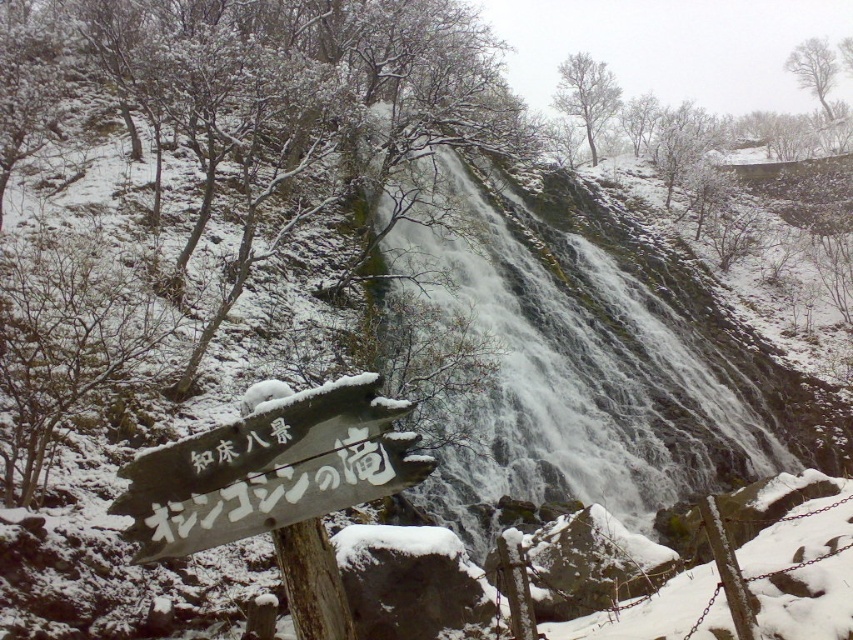
Question: Which of the following is the farthest from the observer?

Choices:
 (A) tap(154, 540)
 (B) tap(518, 420)

Answer: (B)

Question: Is white frothy water at center positioned at the back of white wooden sign at lower left?

Choices:
 (A) yes
 (B) no

Answer: (A)

Question: Is white frothy water at center smaller than white wooden sign at lower left?

Choices:
 (A) yes
 (B) no

Answer: (B)

Question: Is white frothy water at center thinner than white wooden sign at lower left?

Choices:
 (A) no
 (B) yes

Answer: (A)

Question: Which object appears closest to the camera in this image?

Choices:
 (A) white frothy water at center
 (B) white wooden sign at lower left

Answer: (B)